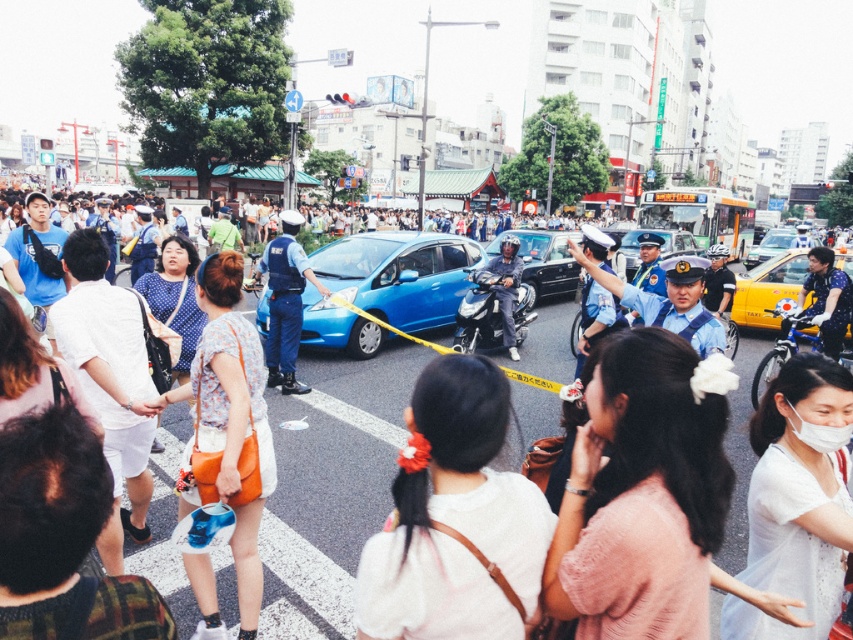
You are standing at the blue car in the middle ground. You see two points marked in the image. Which point, point (718, 348) or point (761, 282), is closer to you?

Point (718, 348) is closer to you than point (761, 282).

You are a pedestrian standing at the crosswalk. You see the light blue uniform at center and the yellow matte taxi at right. Which one is closer to you?

The light blue uniform at center is closer to you because it is in front of the yellow matte taxi at right.

You are a pedestrian trying to cross the street safely. You see the shiny blue car at center and the yellow matte taxi at right. Which vehicle should you be cautious of first?

The shiny blue car at center is in front of the yellow matte taxi at right, so you should be cautious of the shiny blue car at center first as it is closer to you.